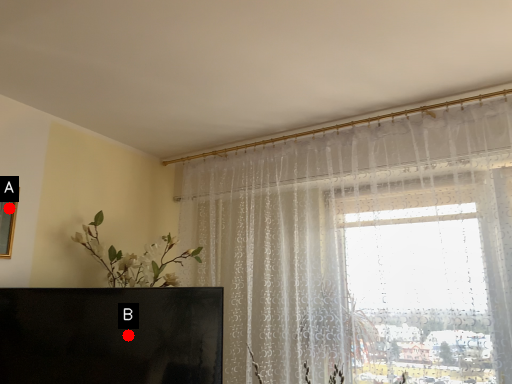
Question: Two points are circled on the image, labeled by A and B beside each circle. Which point is farther to the camera?

Choices:
 (A) A is further
 (B) B is further

Answer: (B)